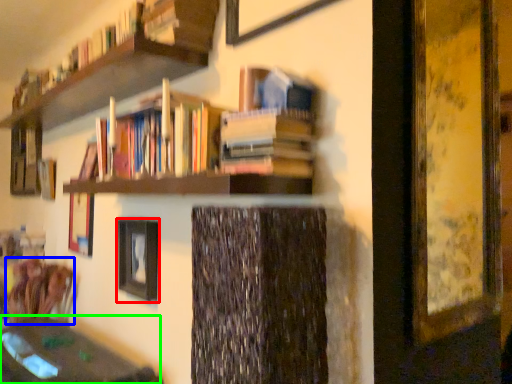
Question: Which object is positioned closest to picture frame (highlighted by a red box)? Select from swivel chair (highlighted by a blue box) and round table (highlighted by a green box).

Choices:
 (A) swivel chair
 (B) round table

Answer: (B)